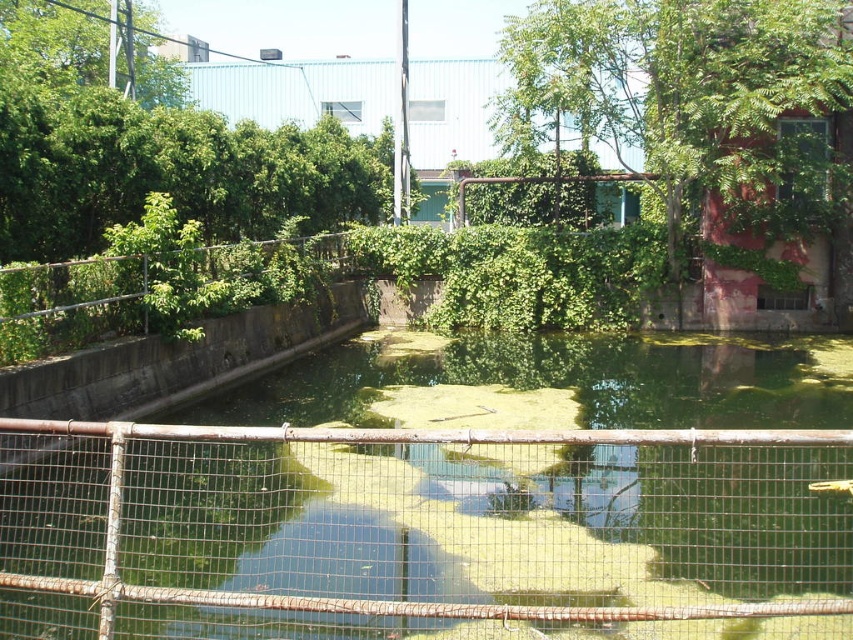
Which is more to the right, green algae water at center or rusty metal fence at upper center?

green algae water at center is more to the right.

Is green algae water at center shorter than rusty metal fence at upper center?

Indeed, green algae water at center has a lesser height compared to rusty metal fence at upper center.

Who is more distant from viewer, (440, 461) or (32, 292)?

The point (440, 461) is behind.

Find the location of a particular element. The width and height of the screenshot is (853, 640). green algae water at center is located at coordinates (450, 500).

In the scene shown: Can you confirm if green algae water at center is taller than green leafy tree at upper right?

No.

Does green algae water at center have a smaller size compared to green leafy tree at upper right?

Correct, green algae water at center occupies less space than green leafy tree at upper right.

At what (x,y) coordinates should I click in order to perform the action: click on green algae water at center. Please return your answer as a coordinate pair (x, y). Looking at the image, I should click on pyautogui.click(x=450, y=500).

Does green leafy tree at upper right appear under green leafy tree at upper left?

Indeed, green leafy tree at upper right is positioned under green leafy tree at upper left.

Is green leafy tree at upper right positioned behind green leafy tree at upper left?

Yes, green leafy tree at upper right is further from the viewer.

Locate an element on the screen. Image resolution: width=853 pixels, height=640 pixels. green leafy tree at upper right is located at coordinates (694, 99).